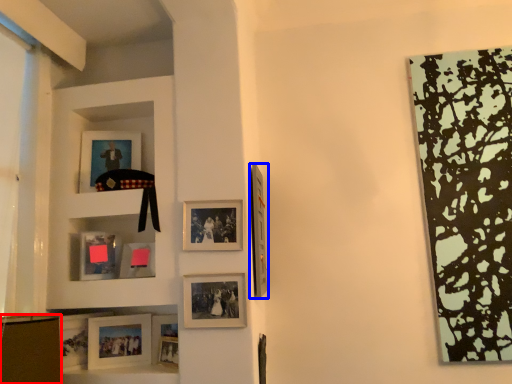
Question: Which object appears farthest to the camera in this image, shelf (highlighted by a red box) or picture frame (highlighted by a blue box)?

Choices:
 (A) shelf
 (B) picture frame

Answer: (B)